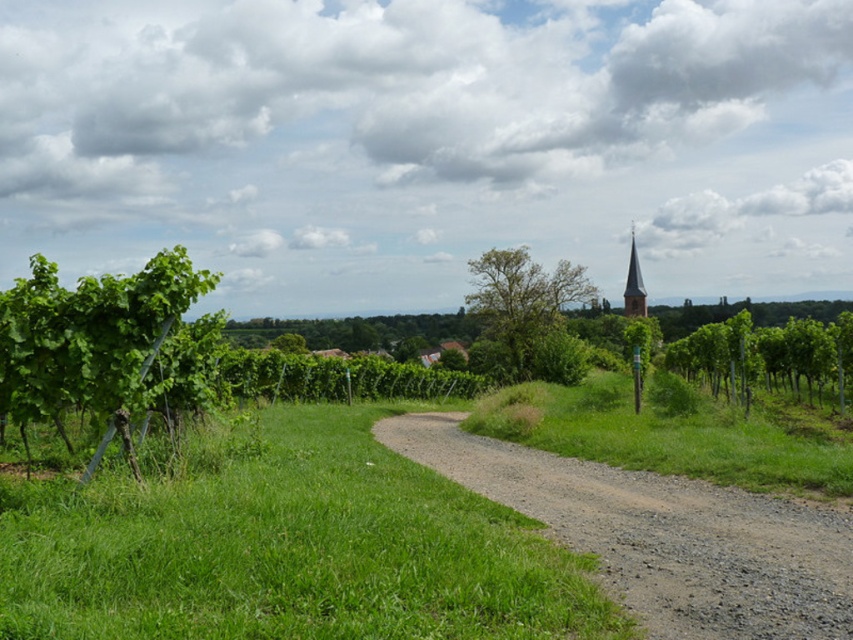
You are standing on the dirt path in the middle of the vineyard and see the green leafy vine at left and the green leafy vine at right. Which one is closer to you?

The green leafy vine at left is closer to you because it is positioned in front of the green leafy vine at right.

You are standing on the dirt path in the vineyard and see the green leafy vine at left and the green leafy tree at center. Which object is closer to you?

The green leafy vine at left is closer to you because it is in front of the green leafy tree at center.